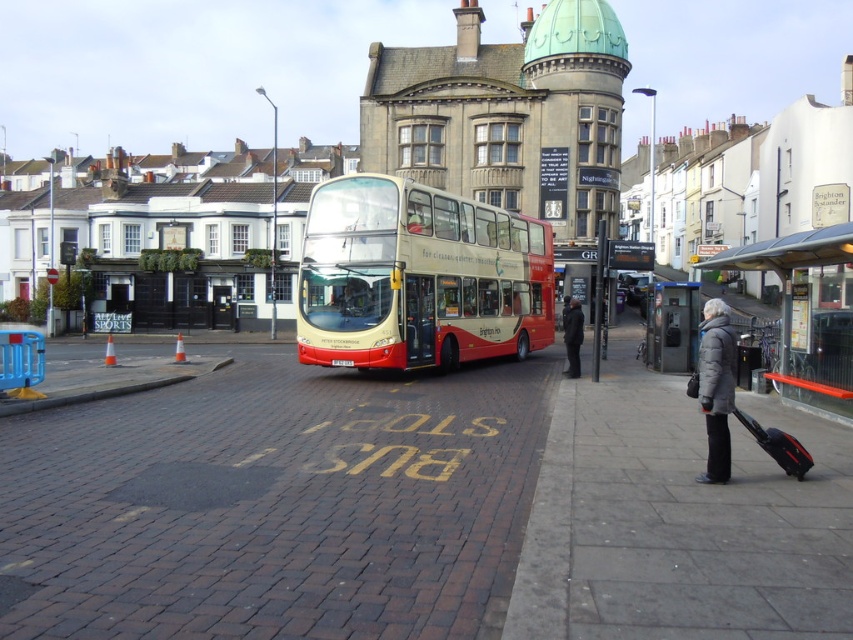
You are a delivery person who needs to place a package on the sidewalk near the bus stop. You see the gray woolen coat at lower right and the black hardshell suitcase at lower right. Which object should you place the package next to if you want it to be closer to the bus?

The gray woolen coat at lower right is positioned on the right side of the black hardshell suitcase at lower right. Since the bus is parked at the bus stop, placing the package next to the black hardshell suitcase at lower right would be closer to the bus.